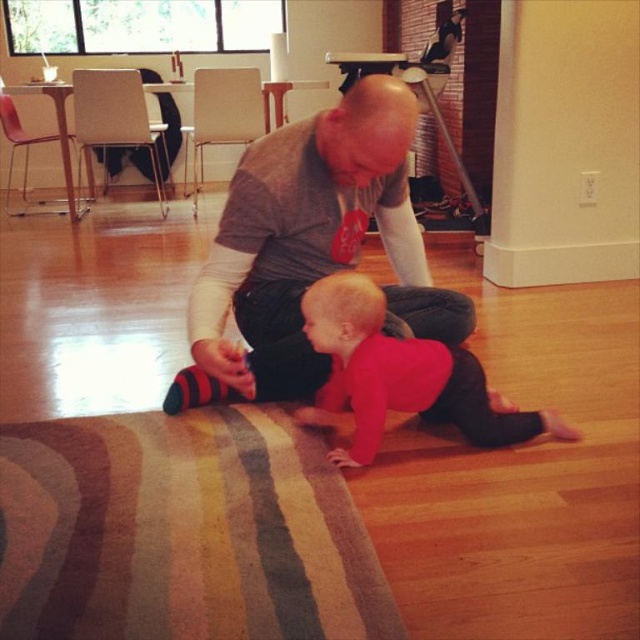
Can you confirm if gray cotton shirt at center is positioned to the right of matte red shirt at center?

In fact, gray cotton shirt at center is to the left of matte red shirt at center.

Between gray cotton shirt at center and matte red shirt at center, which one has more height?

Standing taller between the two is gray cotton shirt at center.

Where is `gray cotton shirt at center`? gray cotton shirt at center is located at coordinates (314, 241).

Where is `gray cotton shirt at center`? This screenshot has height=640, width=640. gray cotton shirt at center is located at coordinates (314, 241).